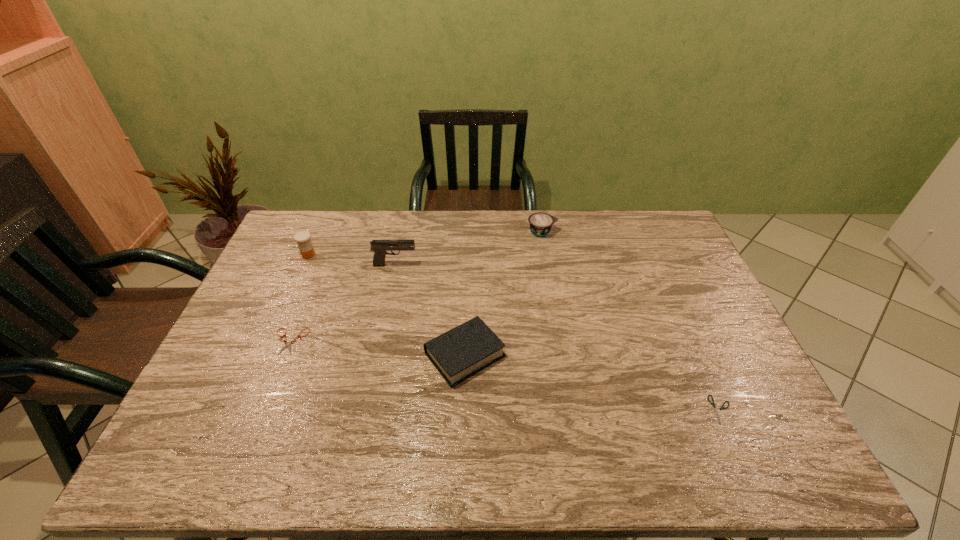
Identify the location of unoccupied area between the Bible and the fourth nearest object. The height and width of the screenshot is (540, 960). (430, 309).

Locate an element on the screen. unoccupied position between the fourth object from right to left and the yogurt is located at coordinates (468, 248).

The height and width of the screenshot is (540, 960). I want to click on free space between the Bible and the nearer shears, so click(x=592, y=382).

The width and height of the screenshot is (960, 540). In order to click on free space between the third object from right to left and the tallest object in this screenshot , I will do `click(430, 309)`.

At what (x,y) coordinates should I click in order to perform the action: click on free space that is in between the nearest object and the yogurt. Please return your answer as a coordinate pair (x, y). The width and height of the screenshot is (960, 540). Looking at the image, I should click on (631, 321).

Image resolution: width=960 pixels, height=540 pixels. Find the location of `unoccupied position between the Bible and the rightmost object`. unoccupied position between the Bible and the rightmost object is located at coordinates (592, 382).

This screenshot has height=540, width=960. In order to click on vacant area that lies between the second object from right to left and the taller shears in this screenshot , I will do `click(416, 287)`.

At what (x,y) coordinates should I click in order to perform the action: click on free space between the rightmost object and the farther shears. Please return your answer as a coordinate pair (x, y). The height and width of the screenshot is (540, 960). Looking at the image, I should click on (504, 375).

I want to click on object identified as the closest to the nearer shears, so click(x=459, y=353).

Image resolution: width=960 pixels, height=540 pixels. I want to click on object that is the third closest to the right shears, so click(379, 247).